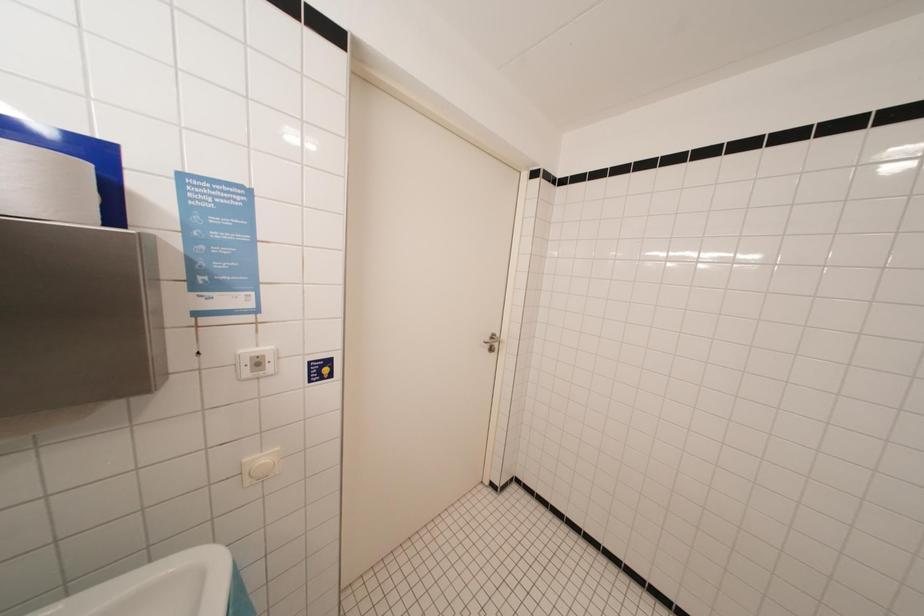
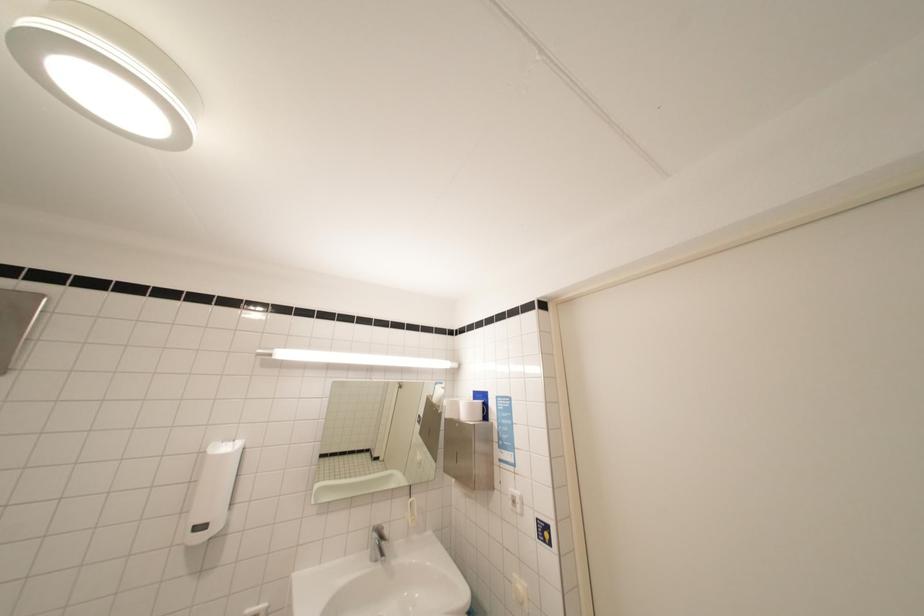
How did the camera likely rotate?

The camera rotated toward left-up.